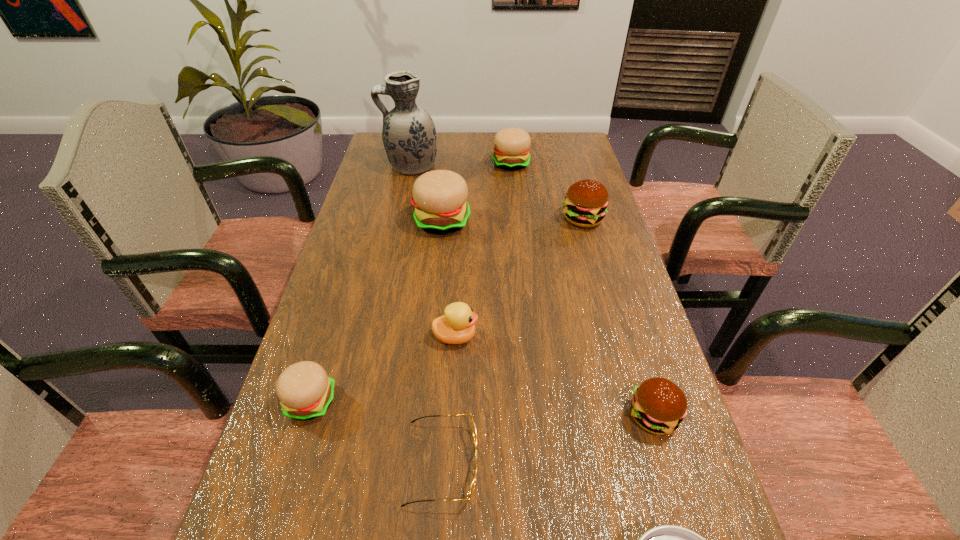
The image size is (960, 540). Identify the location of vase. (409, 136).

The width and height of the screenshot is (960, 540). Find the location of `the tallest object`. the tallest object is located at coordinates (409, 136).

Where is `the eighth shortest object`? This screenshot has height=540, width=960. the eighth shortest object is located at coordinates (439, 197).

The image size is (960, 540). What are the coordinates of `the second farthest beige hamburger` in the screenshot? It's located at (439, 197).

Where is `the farther brown hamburger`? This screenshot has height=540, width=960. the farther brown hamburger is located at coordinates (585, 205).

You are a GUI agent. You are given a task and a screenshot of the screen. Output one action in this format:
    pyautogui.click(x=<x>, y=<y>)
    Task: Click on the rightmost beige hamburger
    
    Given the screenshot: What is the action you would take?
    pyautogui.click(x=512, y=145)

Find the location of a particular element. The height and width of the screenshot is (540, 960). the farthest beige hamburger is located at coordinates (512, 145).

Locate an element on the screen. The height and width of the screenshot is (540, 960). duckling is located at coordinates (457, 326).

Find the location of a particular element. yellow duckling is located at coordinates click(x=457, y=326).

You are a GUI agent. You are given a task and a screenshot of the screen. Output one action in this format:
    pyautogui.click(x=<x>, y=<y>)
    Task: Click on the nearer brown hamburger
    The height and width of the screenshot is (540, 960).
    Given the screenshot: What is the action you would take?
    pyautogui.click(x=658, y=405)